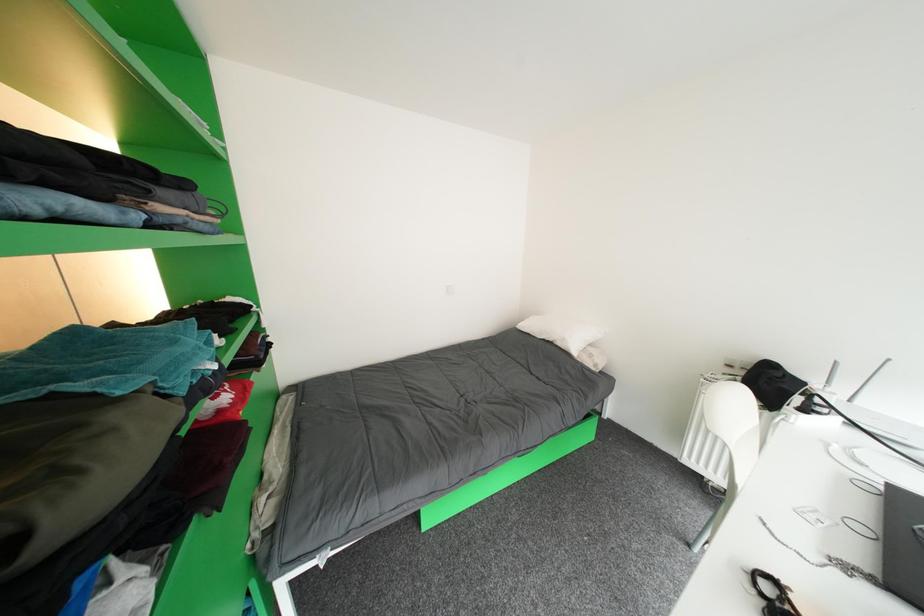
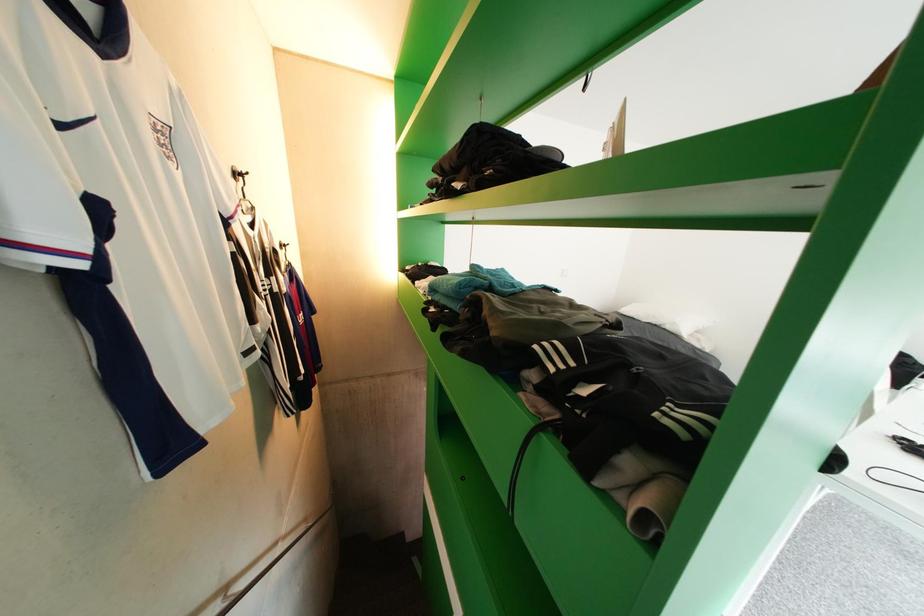
Question: How did the camera likely rotate?

Choices:
 (A) Left
 (B) Right
 (C) Up
 (D) Down

Answer: (A)